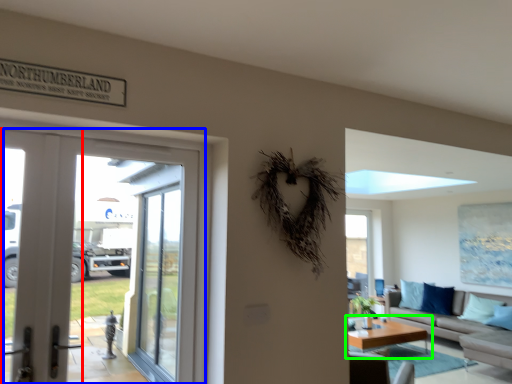
Question: Estimate the real-world distances between objects in this image. Which object is closer to screen door (highlighted by a red box), door (highlighted by a blue box) or coffee table (highlighted by a green box)?

Choices:
 (A) door
 (B) coffee table

Answer: (A)